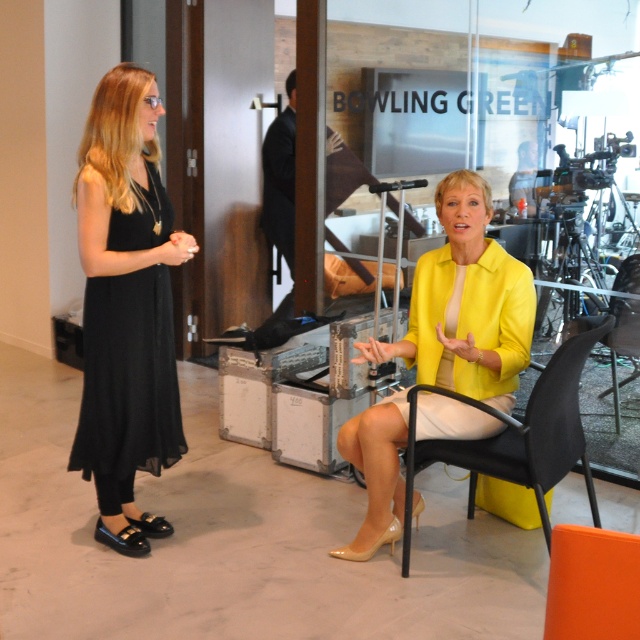
You are a photographer setting up for a portrait. You want to ensure that both the yellow matte blazer at center and the black plastic chair at lower right are visible in the frame. Based on their positions, which object should you focus on first to ensure both are in the shot?

The yellow matte blazer at center is below the black plastic chair at lower right, so focusing on the black plastic chair at lower right first would help ensure both are in the frame since it is positioned higher up.

You are standing in the room and want to hand a gift to the person wearing the black chiffon dress at left. Where should you walk to in order to reach them?

The black chiffon dress at left is located at coordinates point (129, 376), so you should walk towards that point to reach them.

You are a tailor who needs to determine which item is wider between the yellow matte blazer at center and the black plastic chair at lower right. Based on the scene, which one is wider?

The yellow matte blazer at center is wider than the black plastic chair at lower right according to the description.